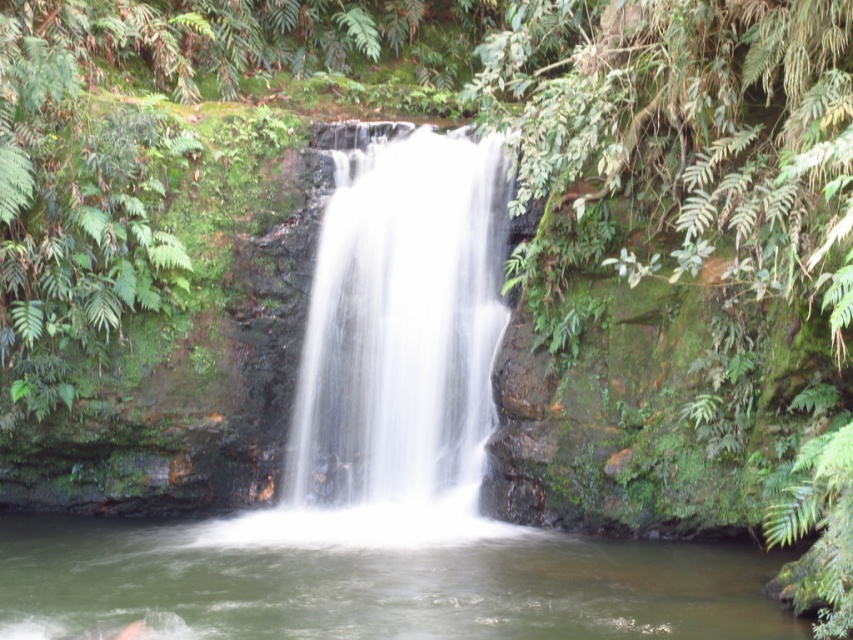
Question: Is greenish water at center wider than white smooth waterfall at center?

Choices:
 (A) no
 (B) yes

Answer: (B)

Question: Observing the image, what is the correct spatial positioning of greenish water at center in reference to white smooth waterfall at center?

Choices:
 (A) left
 (B) right

Answer: (A)

Question: Which point is closer to the camera?

Choices:
 (A) (469, 317)
 (B) (606, 624)

Answer: (B)

Question: Among these points, which one is nearest to the camera?

Choices:
 (A) (393, 500)
 (B) (315, 608)

Answer: (B)

Question: Is greenish water at center to the right of white smooth waterfall at center from the viewer's perspective?

Choices:
 (A) yes
 (B) no

Answer: (B)

Question: Which object is farther from the camera taking this photo?

Choices:
 (A) white smooth waterfall at center
 (B) greenish water at center

Answer: (A)